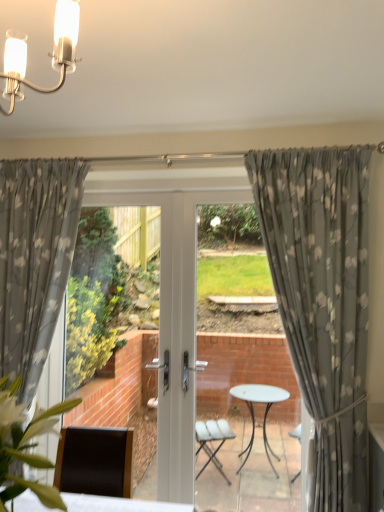
Question: Can you confirm if green leafy plant at lower left is bigger than white glossy light fixture at upper left?

Choices:
 (A) yes
 (B) no

Answer: (A)

Question: Is green leafy plant at lower left further to the viewer compared to white glossy light fixture at upper left?

Choices:
 (A) no
 (B) yes

Answer: (A)

Question: Does green leafy plant at lower left contain white glossy light fixture at upper left?

Choices:
 (A) no
 (B) yes

Answer: (A)

Question: Does green leafy plant at lower left have a smaller size compared to white glossy light fixture at upper left?

Choices:
 (A) yes
 (B) no

Answer: (B)

Question: From the image's perspective, would you say green leafy plant at lower left is positioned over white glossy light fixture at upper left?

Choices:
 (A) yes
 (B) no

Answer: (B)

Question: Does green leafy plant at lower left turn towards white glossy light fixture at upper left?

Choices:
 (A) no
 (B) yes

Answer: (A)

Question: Can you confirm if white glossy light fixture at upper left is smaller than gray floral fabric curtain at center, which is counted as the 2th curtain, starting from the left?

Choices:
 (A) yes
 (B) no

Answer: (A)

Question: Is the surface of white glossy light fixture at upper left in direct contact with gray floral fabric curtain at center, which is counted as the 2th curtain, starting from the left?

Choices:
 (A) no
 (B) yes

Answer: (A)

Question: Is the position of white glossy light fixture at upper left less distant than that of gray floral fabric curtain at center, which is counted as the 2th curtain, starting from the left?

Choices:
 (A) yes
 (B) no

Answer: (A)

Question: Can you confirm if white glossy light fixture at upper left is bigger than gray floral fabric curtain at center, which is counted as the 2th curtain, starting from the left?

Choices:
 (A) no
 (B) yes

Answer: (A)

Question: Is white glossy light fixture at upper left facing towards gray floral fabric curtain at center, the first curtain viewed from the right?

Choices:
 (A) yes
 (B) no

Answer: (B)

Question: From a real-world perspective, does white glossy light fixture at upper left sit lower than gray floral fabric curtain at center, which is counted as the 2th curtain, starting from the left?

Choices:
 (A) no
 (B) yes

Answer: (A)

Question: Would you say gray floral fabric curtain at center, the first curtain viewed from the right, is part of green leafy plant at lower left's contents?

Choices:
 (A) no
 (B) yes

Answer: (A)